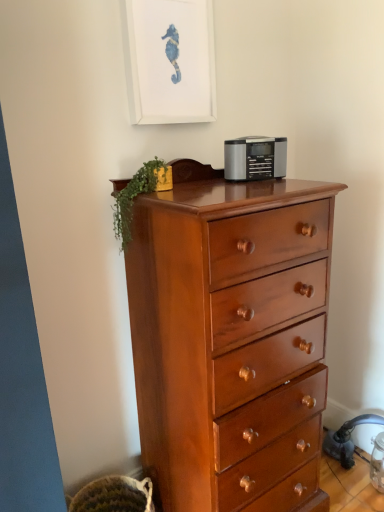
What do you see at coordinates (133, 198) in the screenshot? The height and width of the screenshot is (512, 384). I see `green leafy plant at upper left` at bounding box center [133, 198].

You are a GUI agent. You are given a task and a screenshot of the screen. Output one action in this format:
    pyautogui.click(x=<x>, y=<y>)
    Task: Click on the satin silver radio at center
    
    Given the screenshot: What is the action you would take?
    [x=255, y=158]

How different are the orientations of shiny brown wooden chest of drawers at center and white matte picture frame at upper center in degrees?

3.57 degrees separate the facing orientations of shiny brown wooden chest of drawers at center and white matte picture frame at upper center.

From the image's perspective, between shiny brown wooden chest of drawers at center and white matte picture frame at upper center, which one is located above?

white matte picture frame at upper center is shown above in the image.

Considering the relative sizes of shiny brown wooden chest of drawers at center and white matte picture frame at upper center in the image provided, is shiny brown wooden chest of drawers at center wider than white matte picture frame at upper center?

Yes, shiny brown wooden chest of drawers at center is wider than white matte picture frame at upper center.

Are shiny brown wooden chest of drawers at center and white matte picture frame at upper center located far from each other?

They are positioned close to each other.

Which is more to the right, green leafy plant at upper left or white matte picture frame at upper center?

From the viewer's perspective, white matte picture frame at upper center appears more on the right side.

Is green leafy plant at upper left wider than white matte picture frame at upper center?

Correct, the width of green leafy plant at upper left exceeds that of white matte picture frame at upper center.

Is green leafy plant at upper left directly adjacent to white matte picture frame at upper center?

No.

Is point (121, 212) positioned in front of point (166, 33)?

Yes, point (121, 212) is in front of point (166, 33).

In terms of height, does green leafy plant at upper left look taller or shorter compared to shiny brown wooden chest of drawers at center?

In the image, green leafy plant at upper left appears to be shorter than shiny brown wooden chest of drawers at center.

I want to click on plant behind the shiny brown wooden chest of drawers at center, so click(x=133, y=198).

Is green leafy plant at upper left directly adjacent to shiny brown wooden chest of drawers at center?

No.

Which of these two, green leafy plant at upper left or shiny brown wooden chest of drawers at center, is smaller?

green leafy plant at upper left.

In the scene shown: Between shiny brown wooden chest of drawers at center and satin silver radio at center, which one appears on the right side from the viewer's perspective?

Positioned to the right is satin silver radio at center.

Between point (282, 263) and point (241, 142), which one is positioned in front?

Point (282, 263)

Is satin silver radio at center a part of shiny brown wooden chest of drawers at center?

Yes, satin silver radio at center is a part of shiny brown wooden chest of drawers at center.

Which object is thinner, shiny brown wooden chest of drawers at center or satin silver radio at center?

Thinner between the two is satin silver radio at center.

Looking at this image, is satin silver radio at center turned away from white matte picture frame at upper center?

No.

Does point (269, 163) come closer to viewer compared to point (132, 106)?

No.

From the image's perspective, does satin silver radio at center appear higher than white matte picture frame at upper center?

Actually, satin silver radio at center appears below white matte picture frame at upper center in the image.

Is satin silver radio at center in front of white matte picture frame at upper center?

No, satin silver radio at center is further to the viewer.

Consider the image. Does satin silver radio at center have a greater width compared to shiny brown wooden chest of drawers at center?

Incorrect, the width of satin silver radio at center does not surpass that of shiny brown wooden chest of drawers at center.

Which is in front, satin silver radio at center or shiny brown wooden chest of drawers at center?

shiny brown wooden chest of drawers at center is in front.

From the picture: Which is more to the right, satin silver radio at center or shiny brown wooden chest of drawers at center?

Positioned to the right is satin silver radio at center.

Is satin silver radio at center shorter than shiny brown wooden chest of drawers at center?

Yes, satin silver radio at center is shorter than shiny brown wooden chest of drawers at center.

Which of these two, shiny brown wooden chest of drawers at center or green leafy plant at upper left, stands taller?

With more height is shiny brown wooden chest of drawers at center.

Is shiny brown wooden chest of drawers at center looking in the opposite direction of green leafy plant at upper left?

Correct, shiny brown wooden chest of drawers at center is looking away from green leafy plant at upper left.

Which of these two, shiny brown wooden chest of drawers at center or green leafy plant at upper left, is thinner?

green leafy plant at upper left.

Consider the image. Visually, is shiny brown wooden chest of drawers at center positioned to the left or to the right of green leafy plant at upper left?

Based on their positions, shiny brown wooden chest of drawers at center is located to the right of green leafy plant at upper left.

Where is `picture frame that is on the left side of shiny brown wooden chest of drawers at center`? Image resolution: width=384 pixels, height=512 pixels. picture frame that is on the left side of shiny brown wooden chest of drawers at center is located at coordinates (169, 60).

Where is `plant below the white matte picture frame at upper center (from the image's perspective)`? Image resolution: width=384 pixels, height=512 pixels. plant below the white matte picture frame at upper center (from the image's perspective) is located at coordinates (133, 198).

When comparing their distances from satin silver radio at center, does white matte picture frame at upper center or green leafy plant at upper left seem closer?

green leafy plant at upper left lies closer to satin silver radio at center than the other object.

Based on their spatial positions, is satin silver radio at center or shiny brown wooden chest of drawers at center closer to green leafy plant at upper left?

Among the two, satin silver radio at center is located nearer to green leafy plant at upper left.

From the image, which object appears to be farther from green leafy plant at upper left, white matte picture frame at upper center or shiny brown wooden chest of drawers at center?

shiny brown wooden chest of drawers at center lies further to green leafy plant at upper left than the other object.

Based on their spatial positions, is green leafy plant at upper left or shiny brown wooden chest of drawers at center closer to satin silver radio at center?

Among the two, green leafy plant at upper left is located nearer to satin silver radio at center.

From the image, which object appears to be nearer to green leafy plant at upper left, shiny brown wooden chest of drawers at center or white matte picture frame at upper center?

white matte picture frame at upper center.

Based on their spatial positions, is satin silver radio at center or green leafy plant at upper left closer to shiny brown wooden chest of drawers at center?

Based on the image, green leafy plant at upper left appears to be nearer to shiny brown wooden chest of drawers at center.

Estimate the real-world distances between objects in this image. Which object is closer to white matte picture frame at upper center, green leafy plant at upper left or shiny brown wooden chest of drawers at center?

green leafy plant at upper left is closer to white matte picture frame at upper center.

Estimate the real-world distances between objects in this image. Which object is further from satin silver radio at center, white matte picture frame at upper center or shiny brown wooden chest of drawers at center?

shiny brown wooden chest of drawers at center.

Where is `plant between satin silver radio at center and shiny brown wooden chest of drawers at center in the vertical direction`? The image size is (384, 512). plant between satin silver radio at center and shiny brown wooden chest of drawers at center in the vertical direction is located at coordinates (133, 198).

This screenshot has height=512, width=384. I want to click on appliance between white matte picture frame at upper center and shiny brown wooden chest of drawers at center in the vertical direction, so click(x=255, y=158).

You are a GUI agent. You are given a task and a screenshot of the screen. Output one action in this format:
    pyautogui.click(x=<x>, y=<y>)
    Task: Click on the appliance between white matte picture frame at upper center and green leafy plant at upper left vertically
    
    Given the screenshot: What is the action you would take?
    pyautogui.click(x=255, y=158)

The width and height of the screenshot is (384, 512). Identify the location of plant between white matte picture frame at upper center and shiny brown wooden chest of drawers at center in the vertical direction. (133, 198).